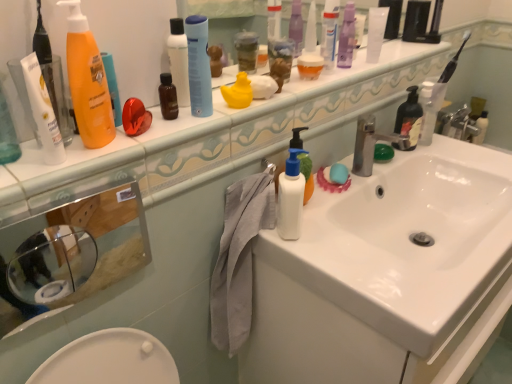
At what (x,y) coordinates should I click in order to perform the action: click on free point to the right of purple glossy bottle at upper center, acting as the fourth toiletry starting from the left. Please return your answer as a coordinate pair (x, y). The height and width of the screenshot is (384, 512). Looking at the image, I should click on (382, 58).